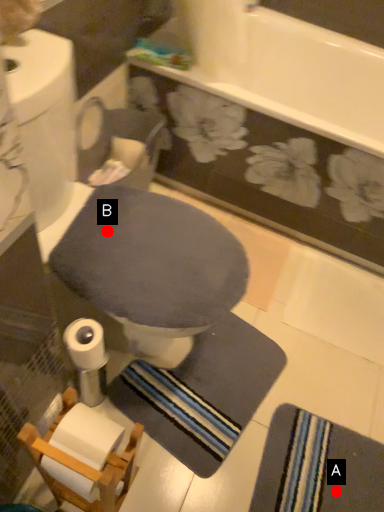
Question: Two points are circled on the image, labeled by A and B beside each circle. Among these points, which one is nearest to the camera?

Choices:
 (A) A is closer
 (B) B is closer

Answer: (B)